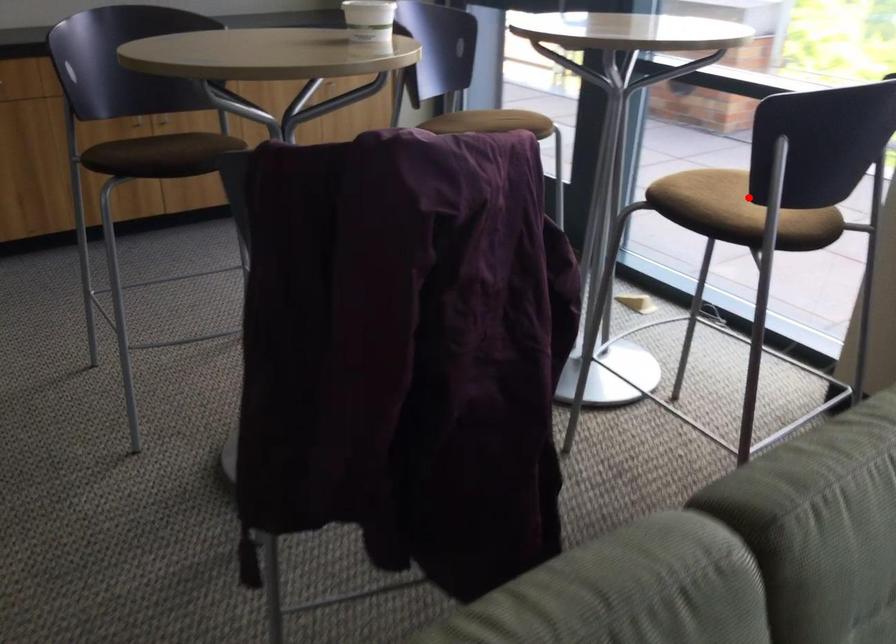
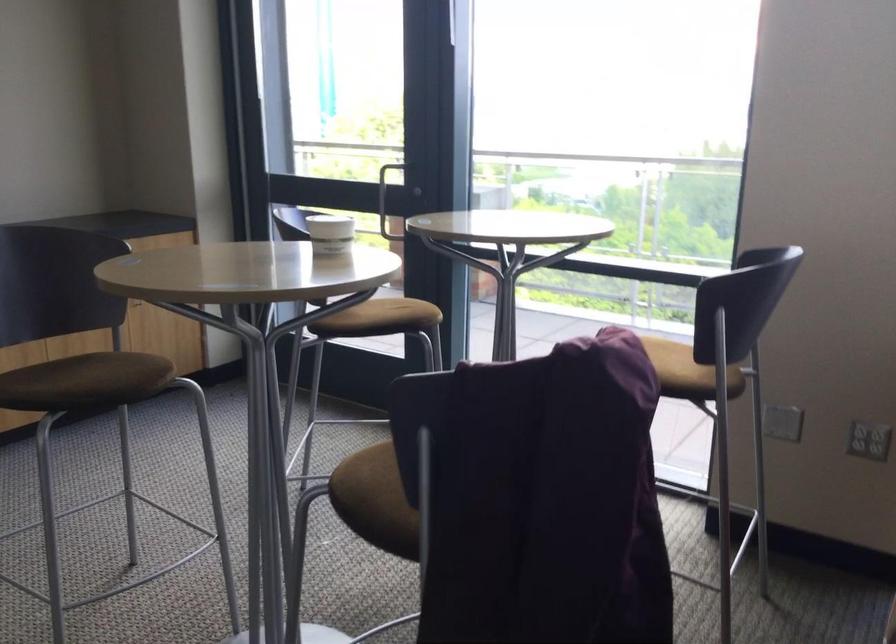
Where in the second image is the point corresponding to the highlighted location from the first image?

(669, 359)